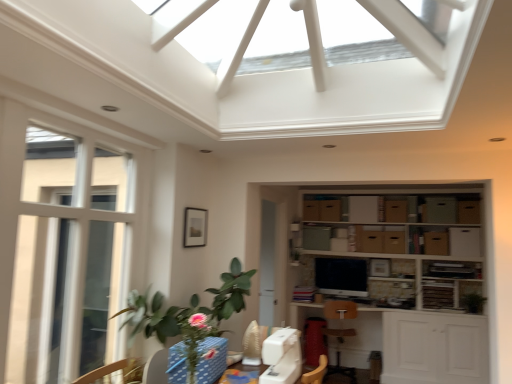
Question: Does wooden shelves at center have a smaller size compared to white glossy exhaust hood at upper center?

Choices:
 (A) yes
 (B) no

Answer: (A)

Question: From the image's perspective, does wooden shelves at center appear higher than white glossy exhaust hood at upper center?

Choices:
 (A) yes
 (B) no

Answer: (B)

Question: From the image's perspective, is wooden shelves at center beneath white glossy exhaust hood at upper center?

Choices:
 (A) no
 (B) yes

Answer: (B)

Question: Can you confirm if wooden shelves at center is taller than white glossy exhaust hood at upper center?

Choices:
 (A) no
 (B) yes

Answer: (B)

Question: Does wooden shelves at center appear on the right side of white glossy exhaust hood at upper center?

Choices:
 (A) no
 (B) yes

Answer: (B)

Question: From a real-world perspective, is white glossy exhaust hood at upper center physically located above or below brown cardboard cabinet at center-right, the 1th cabinetry when ordered from right to left?

Choices:
 (A) below
 (B) above

Answer: (B)

Question: Is white glossy exhaust hood at upper center bigger or smaller than brown cardboard cabinet at center-right, arranged as the first cabinetry when ordered from the bottom?

Choices:
 (A) big
 (B) small

Answer: (A)

Question: Is point (308, 99) closer or farther from the camera than point (442, 251)?

Choices:
 (A) closer
 (B) farther

Answer: (A)

Question: Would you say white glossy exhaust hood at upper center is to the left or to the right of brown cardboard cabinet at center-right, the 1th cabinetry when ordered from right to left, in the picture?

Choices:
 (A) right
 (B) left

Answer: (B)

Question: Based on their sizes in the image, would you say clear glass window at left is bigger or smaller than wooden shelves at center?

Choices:
 (A) small
 (B) big

Answer: (A)

Question: From a real-world perspective, is clear glass window at left positioned above or below wooden shelves at center?

Choices:
 (A) above
 (B) below

Answer: (B)

Question: Is clear glass window at left in front of or behind wooden shelves at center in the image?

Choices:
 (A) behind
 (B) front

Answer: (B)

Question: Considering the positions of clear glass window at left and wooden shelves at center in the image, is clear glass window at left taller or shorter than wooden shelves at center?

Choices:
 (A) short
 (B) tall

Answer: (B)

Question: Is white glossy exhaust hood at upper center bigger or smaller than white plastic swivel chair at center?

Choices:
 (A) big
 (B) small

Answer: (A)

Question: Considering the positions of point (352, 89) and point (254, 350), is point (352, 89) closer or farther from the camera than point (254, 350)?

Choices:
 (A) closer
 (B) farther

Answer: (A)